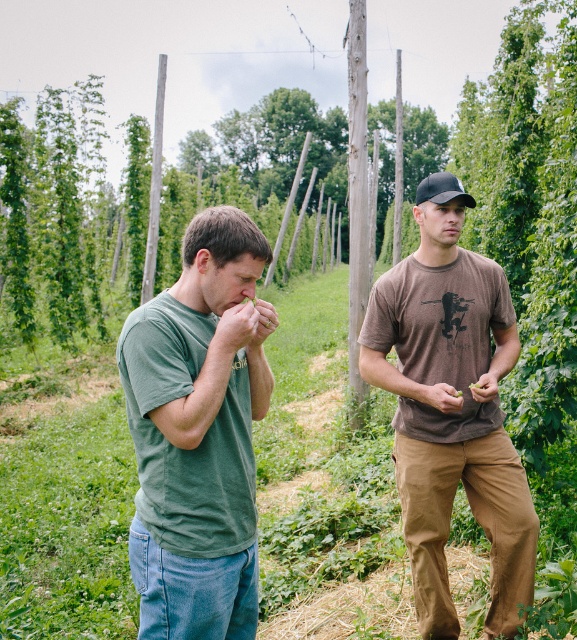
Between green cotton shirt at left and green cotton shirt at center, which one is positioned higher?

Positioned higher is green cotton shirt at left.

Is green cotton shirt at left taller than green cotton shirt at center?

No, green cotton shirt at left is not taller than green cotton shirt at center.

Does point (213, 378) lie in front of point (436, 380)?

That is True.

The image size is (577, 640). I want to click on green cotton shirt at left, so click(x=198, y=433).

From the picture: Who is positioned more to the left, green cotton shirt at center or black matte baseball hat at upper right?

green cotton shirt at center

Who is taller, green cotton shirt at center or black matte baseball hat at upper right?

With more height is green cotton shirt at center.

Where is `green cotton shirt at center`? The height and width of the screenshot is (640, 577). green cotton shirt at center is located at coordinates (451, 413).

Is green cotton shirt at left taller than black matte baseball hat at upper right?

No.

Where is `green cotton shirt at left`? Image resolution: width=577 pixels, height=640 pixels. green cotton shirt at left is located at coordinates (198, 433).

What do you see at coordinates (198, 433) in the screenshot? This screenshot has height=640, width=577. I see `green cotton shirt at left` at bounding box center [198, 433].

Find the location of a particular element. green cotton shirt at left is located at coordinates (198, 433).